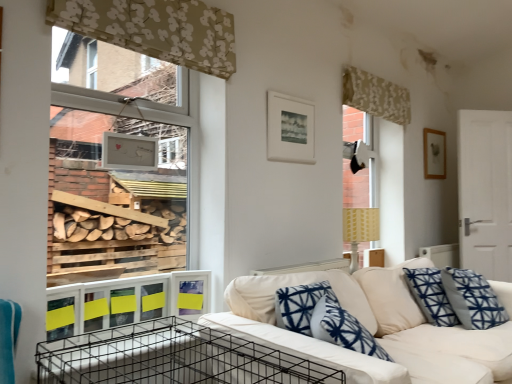
Locate an element on the screen. The width and height of the screenshot is (512, 384). yellow paper at lower left is located at coordinates (125, 301).

Describe the element at coordinates (373, 328) in the screenshot. I see `white fabric couch at center` at that location.

The image size is (512, 384). Describe the element at coordinates (172, 358) in the screenshot. I see `black wire crate at lower left` at that location.

What do you see at coordinates (376, 96) in the screenshot?
I see `patterned fabric curtain at upper right, which is counted as the second curtain, starting from the left` at bounding box center [376, 96].

What do you see at coordinates (434, 154) in the screenshot?
I see `wooden picture frame at upper right, the second picture frame viewed from the left` at bounding box center [434, 154].

Measure the distance between point (72, 21) and camera.

Point (72, 21) is 5.58 feet from camera.

At what (x,y) coordinates should I click in order to perform the action: click on yellow paper at lower left. Please return your answer as a coordinate pair (x, y). Looking at the image, I should click on (125, 301).

Based on their sizes in the image, would you say beige floral fabric at upper center, placed as the first curtain when sorted from front to back, is bigger or smaller than black wire crate at lower left?

beige floral fabric at upper center, placed as the first curtain when sorted from front to back, is smaller than black wire crate at lower left.

From a real-world perspective, is beige floral fabric at upper center, arranged as the 2th curtain when viewed from the back, positioned under black wire crate at lower left based on gravity?

No, from a real-world perspective, beige floral fabric at upper center, arranged as the 2th curtain when viewed from the back, is not below black wire crate at lower left.

Could you tell me if beige floral fabric at upper center, the 2th curtain positioned from the right, is turned towards black wire crate at lower left?

No, beige floral fabric at upper center, the 2th curtain positioned from the right, does not turn towards black wire crate at lower left.

Is beige floral fabric at upper center, the first curtain viewed from the left, not inside black wire crate at lower left?

Yes, beige floral fabric at upper center, the first curtain viewed from the left, is outside of black wire crate at lower left.

Does point (266, 311) lie in front of point (134, 44)?

Yes, it is.

Which is more to the left, white fabric couch at center or beige floral fabric at upper center, placed as the first curtain when sorted from front to back?

beige floral fabric at upper center, placed as the first curtain when sorted from front to back.

Considering the sizes of objects white fabric couch at center and beige floral fabric at upper center, the first curtain viewed from the left, in the image provided, who is shorter, white fabric couch at center or beige floral fabric at upper center, the first curtain viewed from the left,?

beige floral fabric at upper center, the first curtain viewed from the left, is shorter.

From the image's perspective, which one is positioned higher, white fabric couch at center or beige floral fabric at upper center, arranged as the 2th curtain when viewed from the back?

beige floral fabric at upper center, arranged as the 2th curtain when viewed from the back, from the image's perspective.

Which of these two, black wire crate at lower left or white matte picture frame at upper center, marked as the second picture frame in a right-to-left arrangement, is smaller?

white matte picture frame at upper center, marked as the second picture frame in a right-to-left arrangement, is smaller.

Considering the relative positions of black wire crate at lower left and white matte picture frame at upper center, which ranks as the first picture frame in left-to-right order, in the image provided, is black wire crate at lower left behind white matte picture frame at upper center, which ranks as the first picture frame in left-to-right order,?

No.

Is point (220, 378) more distant than point (285, 99)?

No, (220, 378) is closer to viewer.

Is black wire crate at lower left positioned far away from white matte picture frame at upper center, which ranks as the first picture frame in left-to-right order?

Yes, black wire crate at lower left and white matte picture frame at upper center, which ranks as the first picture frame in left-to-right order, are located far from each other.

Considering the sizes of objects yellow paper at lower left and white matte picture frame at upper center, which is the second picture frame in back-to-front order, in the image provided, who is thinner, yellow paper at lower left or white matte picture frame at upper center, which is the second picture frame in back-to-front order,?

Thinner between the two is yellow paper at lower left.

Considering the sizes of yellow paper at lower left and white matte picture frame at upper center, placed as the first picture frame when sorted from front to back, in the image, is yellow paper at lower left bigger or smaller than white matte picture frame at upper center, placed as the first picture frame when sorted from front to back,?

yellow paper at lower left is smaller than white matte picture frame at upper center, placed as the first picture frame when sorted from front to back.

Is white fabric couch at center at the back of patterned fabric curtain at upper right, which is counted as the second curtain, starting from the left?

No, patterned fabric curtain at upper right, which is counted as the second curtain, starting from the left, is not facing the opposite direction of white fabric couch at center.

Considering the sizes of patterned fabric curtain at upper right, which appears as the first curtain when viewed from the right, and white fabric couch at center in the image, is patterned fabric curtain at upper right, which appears as the first curtain when viewed from the right, taller or shorter than white fabric couch at center?

Considering their sizes, patterned fabric curtain at upper right, which appears as the first curtain when viewed from the right, has less height than white fabric couch at center.

From a real-world perspective, between patterned fabric curtain at upper right, marked as the 2th curtain in a front-to-back arrangement, and white fabric couch at center, who is vertically lower?

white fabric couch at center.

Could white fabric couch at center be considered to be inside white matte picture frame at upper center, which is the second picture frame in back-to-front order?

No, white fabric couch at center is located outside of white matte picture frame at upper center, which is the second picture frame in back-to-front order.

Is point (294, 114) more distant than point (358, 305)?

Yes, point (294, 114) is behind point (358, 305).

Is white matte picture frame at upper center, placed as the first picture frame when sorted from front to back, next to white fabric couch at center and touching it?

white matte picture frame at upper center, placed as the first picture frame when sorted from front to back, is not next to white fabric couch at center, and they're not touching.

Visually, is white matte picture frame at upper center, which is the second picture frame in back-to-front order, positioned to the left or to the right of white fabric couch at center?

From the image, it's evident that white matte picture frame at upper center, which is the second picture frame in back-to-front order, is to the left of white fabric couch at center.

Is patterned fabric curtain at upper right, which is counted as the second curtain, starting from the left, outside of white matte picture frame at upper center, placed as the first picture frame when sorted from front to back?

Yes.

From a real-world perspective, is patterned fabric curtain at upper right, which is counted as the second curtain, starting from the left, on white matte picture frame at upper center, which ranks as the first picture frame in left-to-right order?

Yes, from a real-world perspective, patterned fabric curtain at upper right, which is counted as the second curtain, starting from the left, is over white matte picture frame at upper center, which ranks as the first picture frame in left-to-right order

Where is `picture frame that is the 1st object located below the patterned fabric curtain at upper right, which ranks as the first curtain in back-to-front order (from the image's perspective)`? This screenshot has width=512, height=384. picture frame that is the 1st object located below the patterned fabric curtain at upper right, which ranks as the first curtain in back-to-front order (from the image's perspective) is located at coordinates (290, 129).

Is patterned fabric curtain at upper right, marked as the 2th curtain in a front-to-back arrangement, aimed at white matte picture frame at upper center, which ranks as the first picture frame in left-to-right order?

No, patterned fabric curtain at upper right, marked as the 2th curtain in a front-to-back arrangement, is not aimed at white matte picture frame at upper center, which ranks as the first picture frame in left-to-right order.

At what (x,y) coordinates should I click in order to perform the action: click on curtain on the left of black wire crate at lower left. Please return your answer as a coordinate pair (x, y). Looking at the image, I should click on (155, 29).

At what (x,y) coordinates should I click in order to perform the action: click on curtain that is the 1st one when counting backward from the white fabric couch at center. Please return your answer as a coordinate pair (x, y). This screenshot has width=512, height=384. Looking at the image, I should click on (155, 29).

From the image, which object appears to be farther from patterned fabric curtain at upper right, which appears as the first curtain when viewed from the right, black wire crate at lower left or white fabric couch at center?

black wire crate at lower left is further to patterned fabric curtain at upper right, which appears as the first curtain when viewed from the right.

Which object lies nearer to the anchor point beige floral fabric at upper center, the 2th curtain positioned from the right, yellow paper at lower left or wooden picture frame at upper right, the second picture frame viewed from the left?

yellow paper at lower left.

From the image, which object appears to be nearer to wooden picture frame at upper right, which appears as the 1th picture frame when viewed from the right, patterned fabric curtain at upper right, which ranks as the first curtain in back-to-front order, or white matte picture frame at upper center, marked as the second picture frame in a right-to-left arrangement?

Among the two, patterned fabric curtain at upper right, which ranks as the first curtain in back-to-front order, is located nearer to wooden picture frame at upper right, which appears as the 1th picture frame when viewed from the right.

Based on their spatial positions, is white fabric couch at center or wooden picture frame at upper right, the 2th picture frame from the front, further from black wire crate at lower left?

The object further to black wire crate at lower left is wooden picture frame at upper right, the 2th picture frame from the front.

Based on their spatial positions, is black wire crate at lower left or white fabric couch at center further from beige floral fabric at upper center, arranged as the 2th curtain when viewed from the back?

black wire crate at lower left is positioned further to the anchor beige floral fabric at upper center, arranged as the 2th curtain when viewed from the back.

Looking at the image, which one is located closer to beige floral fabric at upper center, the first curtain viewed from the left, white matte picture frame at upper center, marked as the second picture frame in a right-to-left arrangement, or wooden picture frame at upper right, the 1th picture frame from the back?

Based on the image, white matte picture frame at upper center, marked as the second picture frame in a right-to-left arrangement, appears to be nearer to beige floral fabric at upper center, the first curtain viewed from the left.

Considering their positions, is black wire crate at lower left positioned closer to beige floral fabric at upper center, the first curtain viewed from the left, than white matte picture frame at upper center, which is the second picture frame in back-to-front order?

white matte picture frame at upper center, which is the second picture frame in back-to-front order, is closer to beige floral fabric at upper center, the first curtain viewed from the left.

Estimate the real-world distances between objects in this image. Which object is closer to yellow paper at lower left, white matte picture frame at upper center, which is the second picture frame in back-to-front order, or white fabric couch at center?

white fabric couch at center.

Where is `picture frame positioned between black wire crate at lower left and wooden picture frame at upper right, the 2th picture frame from the front, from near to far`? picture frame positioned between black wire crate at lower left and wooden picture frame at upper right, the 2th picture frame from the front, from near to far is located at coordinates (290, 129).

Where is `curtain between white matte picture frame at upper center, which is the second picture frame in back-to-front order, and wooden picture frame at upper right, the 1th picture frame from the back, from left to right`? This screenshot has width=512, height=384. curtain between white matte picture frame at upper center, which is the second picture frame in back-to-front order, and wooden picture frame at upper right, the 1th picture frame from the back, from left to right is located at coordinates (376, 96).

Image resolution: width=512 pixels, height=384 pixels. I want to click on picture frame between yellow paper at lower left and wooden picture frame at upper right, which appears as the 1th picture frame when viewed from the right, so click(x=290, y=129).

Where is `crate between beige floral fabric at upper center, the 2th curtain positioned from the right, and white fabric couch at center in the up-down direction`? The height and width of the screenshot is (384, 512). crate between beige floral fabric at upper center, the 2th curtain positioned from the right, and white fabric couch at center in the up-down direction is located at coordinates (172, 358).